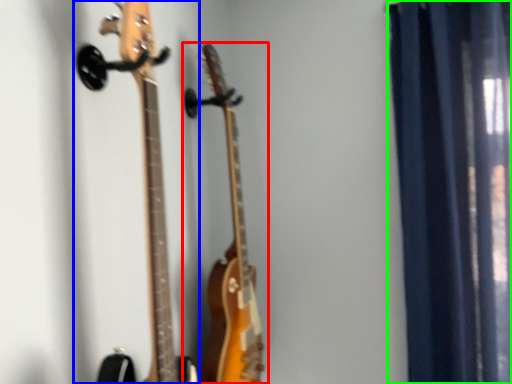
Question: Considering the real-world distances, which object is farthest from guitar (highlighted by a red box)? guitar (highlighted by a blue box) or curtain (highlighted by a green box)?

Choices:
 (A) guitar
 (B) curtain

Answer: (B)